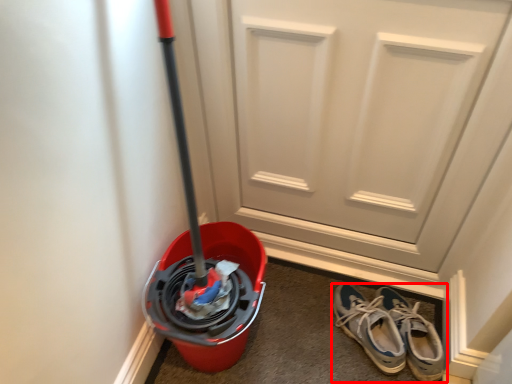
Question: From the image, what is the correct spatial relationship of footwear (annotated by the red box) in relation to door?

Choices:
 (A) left
 (B) right

Answer: (B)